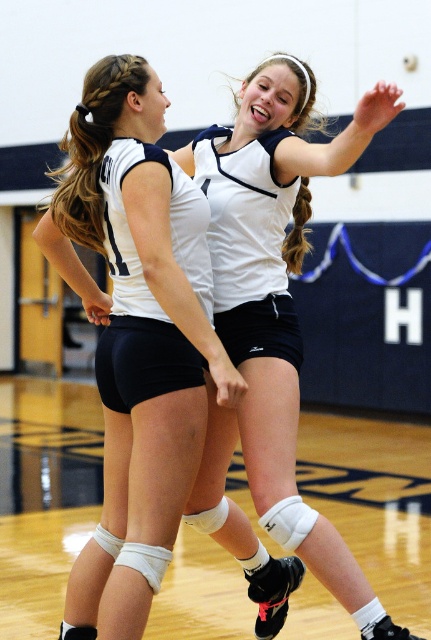
Can you confirm if white matte volleyball jersey at center is positioned to the right of white matte volleyball at center?

Incorrect, white matte volleyball jersey at center is not on the right side of white matte volleyball at center.

Is point (93, 184) positioned behind point (308, 196)?

No, (93, 184) is closer to viewer.

The width and height of the screenshot is (431, 640). In order to click on white matte volleyball jersey at center in this screenshot , I will do `click(134, 314)`.